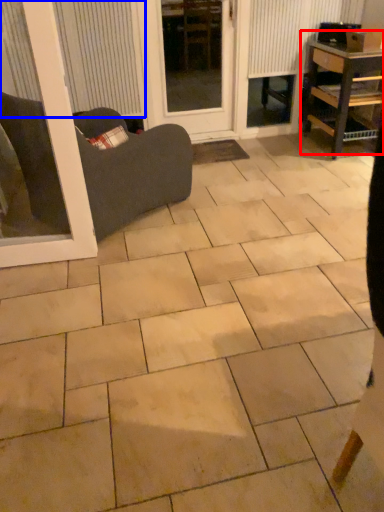
Question: Which object is further to the camera taking this photo, table (highlighted by a red box) or blind (highlighted by a blue box)?

Choices:
 (A) table
 (B) blind

Answer: (A)